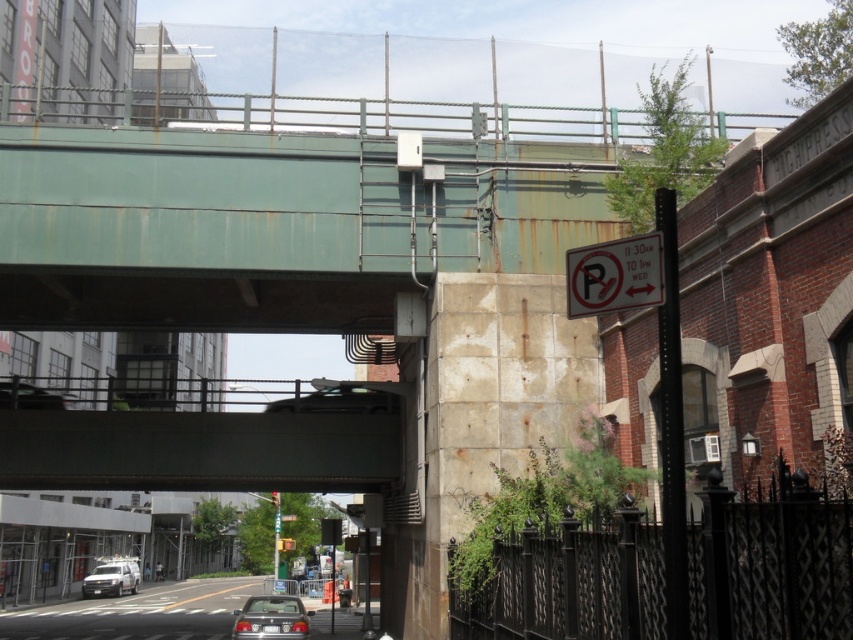
Which is more to the right, dark gray concrete bridge at center or silver metallic van at lower left?

From the viewer's perspective, dark gray concrete bridge at center appears more on the right side.

The height and width of the screenshot is (640, 853). Find the location of `dark gray concrete bridge at center`. dark gray concrete bridge at center is located at coordinates (206, 448).

At what (x,y) coordinates should I click in order to perform the action: click on matte silver sedan at lower center. Please return your answer as a coordinate pair (x, y). The width and height of the screenshot is (853, 640). Looking at the image, I should click on 271,618.

Does matte silver sedan at lower center have a lesser height compared to silver metallic van at lower left?

No.

Is point (294, 596) positioned after point (109, 586)?

No, it is in front of (109, 586).

Identify the location of matte silver sedan at lower center. (271, 618).

Who is shorter, white plastic sign at upper right or matte silver sedan at lower center?

white plastic sign at upper right is shorter.

Who is higher up, white plastic sign at upper right or matte silver sedan at lower center?

white plastic sign at upper right

Is point (657, 234) farther from camera compared to point (260, 614)?

No.

Where is `white plastic sign at upper right`? This screenshot has width=853, height=640. white plastic sign at upper right is located at coordinates (614, 275).